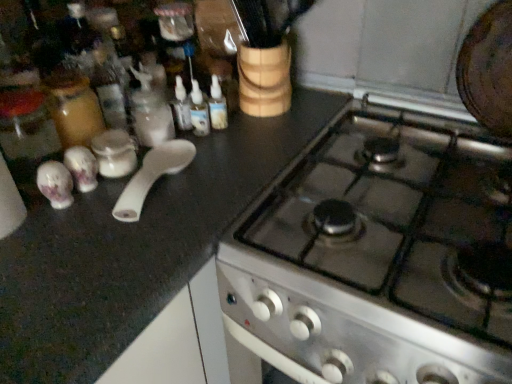
Question: From the image's perspective, is white glossy spoon at upper left located above or below white plastic spoon at left?

Choices:
 (A) above
 (B) below

Answer: (A)

Question: Is point (122, 160) closer or farther from the camera than point (181, 148)?

Choices:
 (A) farther
 (B) closer

Answer: (B)

Question: Which of these objects is positioned closest to the white glossy spoon at upper left?

Choices:
 (A) white glossy salt and pepper shakers at left
 (B) white plastic spoon at left
 (C) metallic silver gas stove at center
 (D) translucent plastic bottles at center, the first bottle from the right
 (E) translucent plastic bottles at center, the 2th bottle viewed from the right

Answer: (A)

Question: Which object is positioned farthest from the white glossy salt and pepper shakers at left?

Choices:
 (A) white plastic spoon at left
 (B) translucent plastic bottles at center, the 2th bottle viewed from the right
 (C) translucent plastic bottles at center, the first bottle from the right
 (D) metallic silver gas stove at center
 (E) white glossy spoon at upper left

Answer: (D)